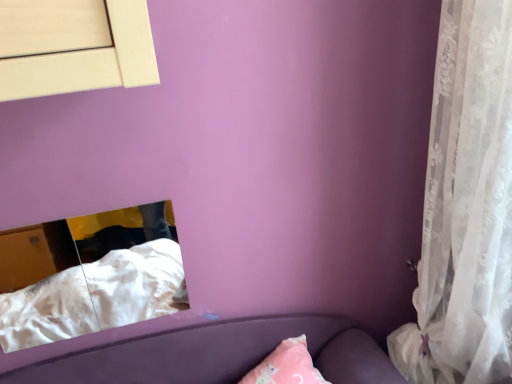
Question: Does white lace curtain at right have a smaller size compared to white soft fabric at lower left?

Choices:
 (A) no
 (B) yes

Answer: (A)

Question: Does white lace curtain at right have a greater height compared to white soft fabric at lower left?

Choices:
 (A) yes
 (B) no

Answer: (A)

Question: Are white lace curtain at right and white soft fabric at lower left far apart?

Choices:
 (A) no
 (B) yes

Answer: (B)

Question: Is white lace curtain at right thinner than white soft fabric at lower left?

Choices:
 (A) no
 (B) yes

Answer: (A)

Question: Is the position of white lace curtain at right more distant than that of white soft fabric at lower left?

Choices:
 (A) no
 (B) yes

Answer: (A)

Question: Is white lace curtain at right located outside white soft fabric at lower left?

Choices:
 (A) no
 (B) yes

Answer: (B)

Question: Can you confirm if white soft fabric at lower left is positioned to the right of white lace curtain at right?

Choices:
 (A) yes
 (B) no

Answer: (B)

Question: Considering the relative sizes of white soft fabric at lower left and white lace curtain at right in the image provided, is white soft fabric at lower left bigger than white lace curtain at right?

Choices:
 (A) yes
 (B) no

Answer: (B)

Question: Is white soft fabric at lower left not near white lace curtain at right?

Choices:
 (A) no
 (B) yes

Answer: (B)

Question: From a real-world perspective, is white soft fabric at lower left beneath white lace curtain at right?

Choices:
 (A) yes
 (B) no

Answer: (A)

Question: Is white soft fabric at lower left facing away from white lace curtain at right?

Choices:
 (A) yes
 (B) no

Answer: (B)

Question: Is white soft fabric at lower left further to camera compared to white lace curtain at right?

Choices:
 (A) yes
 (B) no

Answer: (A)

Question: Is point (81, 307) closer or farther from the camera than point (422, 339)?

Choices:
 (A) closer
 (B) farther

Answer: (B)